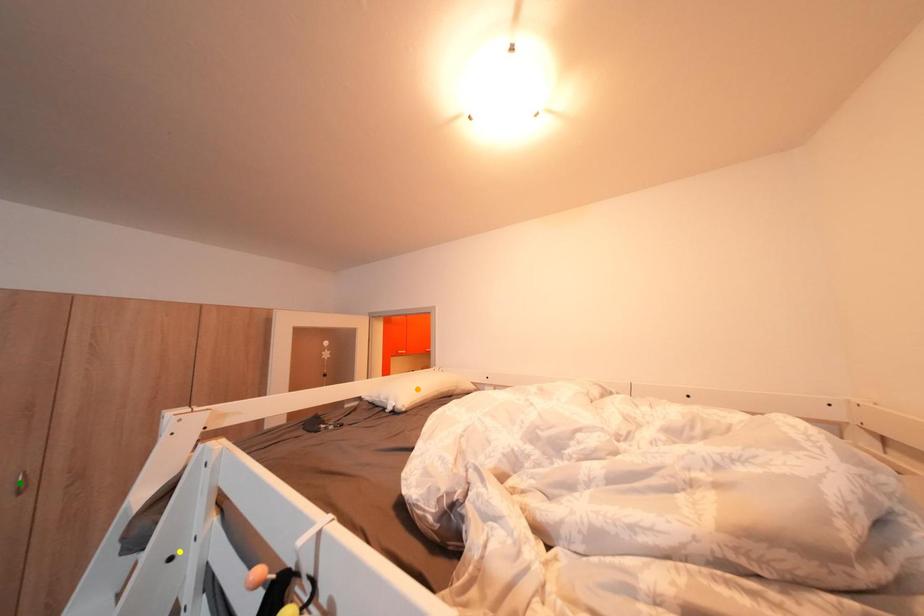
Order these from nearest to farthest:
orange point, yellow point, green point

orange point
green point
yellow point